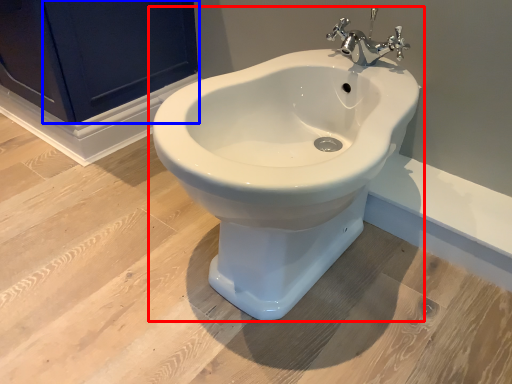
Question: Which point is further to the camera, toilet (highlighted by a red box) or screen door (highlighted by a blue box)?

Choices:
 (A) toilet
 (B) screen door

Answer: (B)